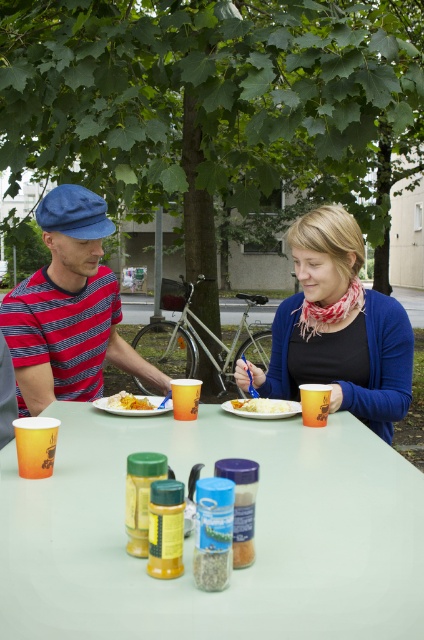
Question: Does striped cotton shirt at left have a lesser width compared to white matte rice at center?

Choices:
 (A) no
 (B) yes

Answer: (A)

Question: Which object appears farthest from the camera in this image?

Choices:
 (A) matte blue scarf at center
 (B) striped cotton shirt at left

Answer: (B)

Question: Which object is farther from the camera taking this photo?

Choices:
 (A) striped cotton shirt at left
 (B) white plastic table at center

Answer: (A)

Question: Is white plastic table at center behind white matte rice at center?

Choices:
 (A) no
 (B) yes

Answer: (A)

Question: Which object is positioned farthest from the white matte rice at center?

Choices:
 (A) striped cotton shirt at left
 (B) matte striped shirt at left
 (C) white plastic table at center

Answer: (A)

Question: Considering the relative positions of white plastic table at center and matte plastic plate at center in the image provided, where is white plastic table at center located with respect to matte plastic plate at center?

Choices:
 (A) left
 (B) right

Answer: (B)